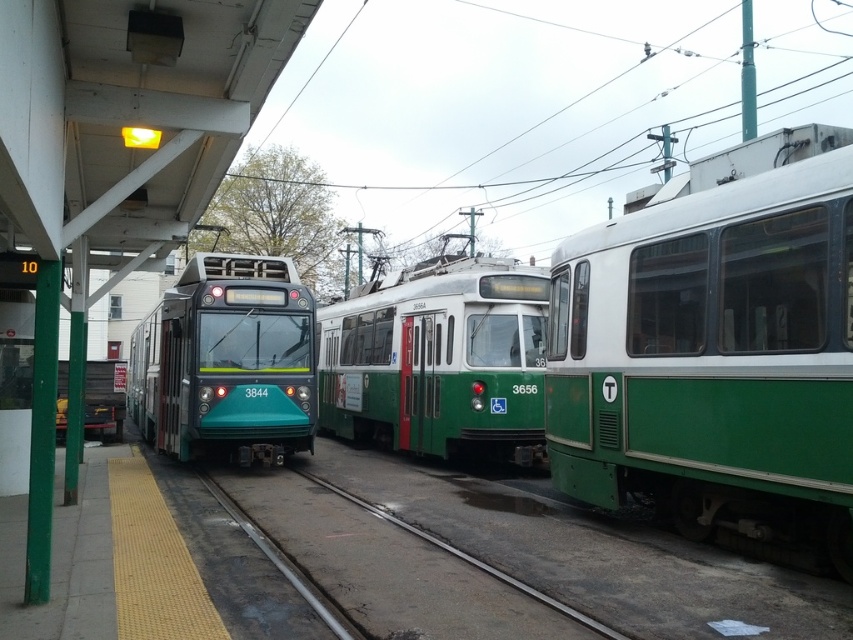
You are a passenger waiting at the tram station. You need to board the tram that is larger in size. Which tram should you choose between the green matte train at center and the teal glossy train at center?

The teal glossy train at center is larger in size compared to the green matte train at center, so you should choose the teal glossy train at center.

You are standing on the platform at the tram station. You notice the green matte train at center. Can you estimate its location in coordinates?

The green matte train at center is located at coordinates point (x=439, y=358).